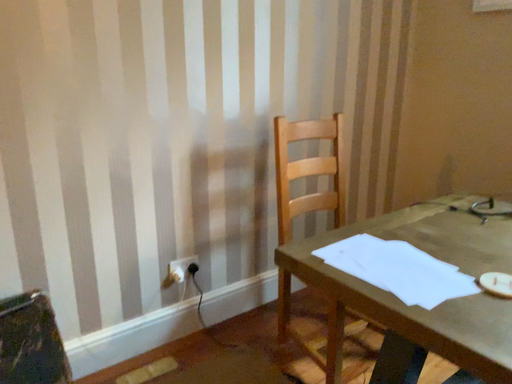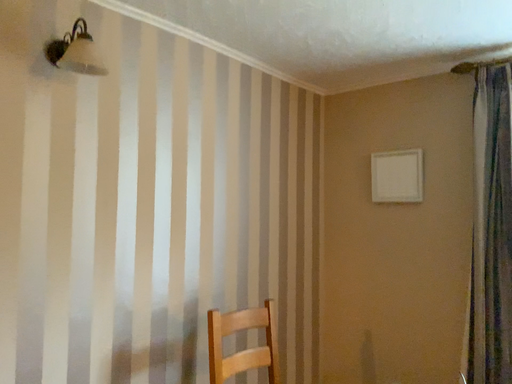
Question: How did the camera likely rotate when shooting the video?

Choices:
 (A) rotated right
 (B) rotated left

Answer: (A)